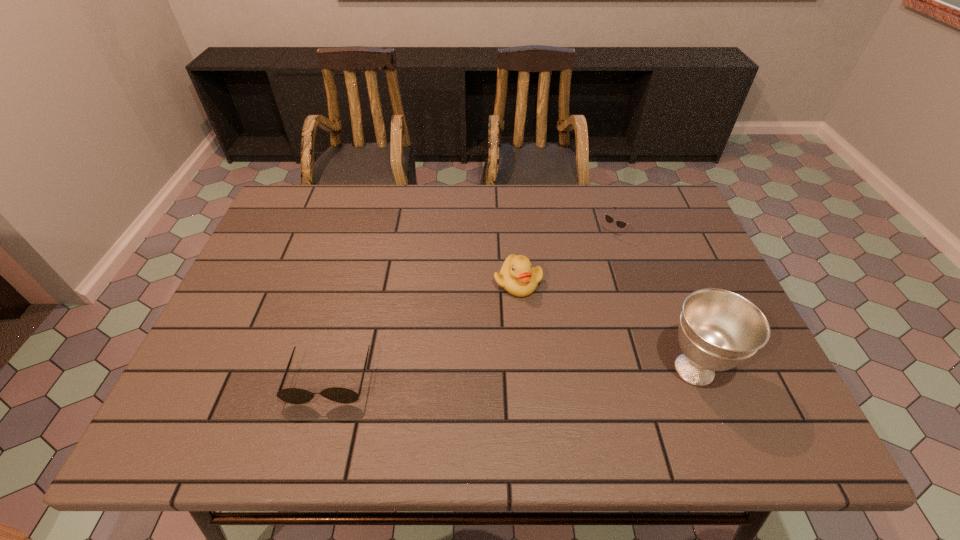
Locate an element on the screen. This screenshot has height=540, width=960. vacant space on the desktop that is between the nearer sunglasses and the tallest object and is positioned in front of the lenses of the farthest object is located at coordinates (479, 375).

This screenshot has height=540, width=960. I want to click on free space on the desktop that is between the leftmost object and the tallest object and is positioned on the beak of the duckling, so click(483, 374).